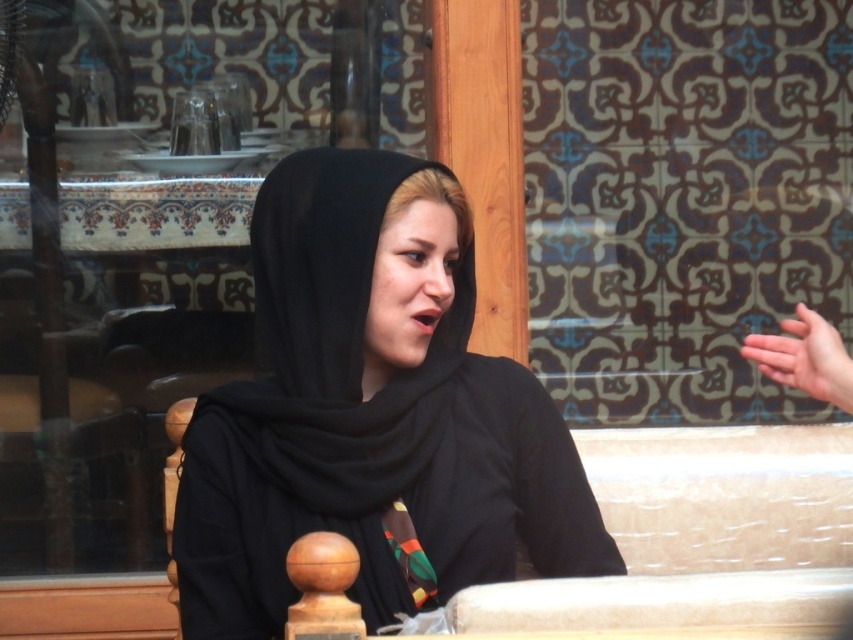
Is black matte headscarf at center to the right of smooth skin hand at right from the viewer's perspective?

In fact, black matte headscarf at center is to the left of smooth skin hand at right.

Is black matte headscarf at center taller than smooth skin hand at right?

Yes, black matte headscarf at center is taller than smooth skin hand at right.

The height and width of the screenshot is (640, 853). Find the location of `black matte headscarf at center`. black matte headscarf at center is located at coordinates (370, 412).

The height and width of the screenshot is (640, 853). Identify the location of black matte headscarf at center. click(370, 412).